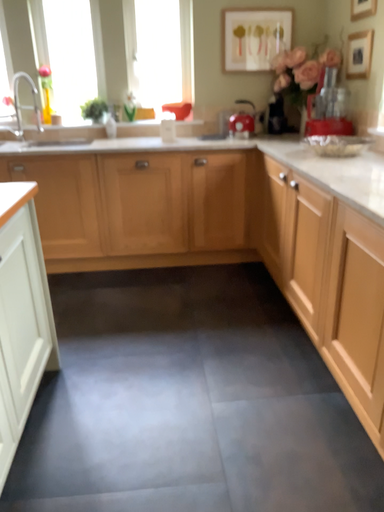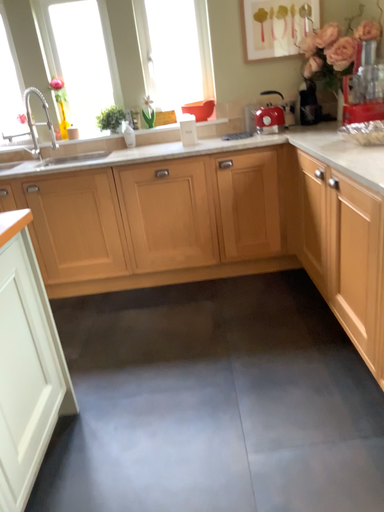
Question: How did the camera likely rotate when shooting the video?

Choices:
 (A) rotated left
 (B) rotated right

Answer: (A)